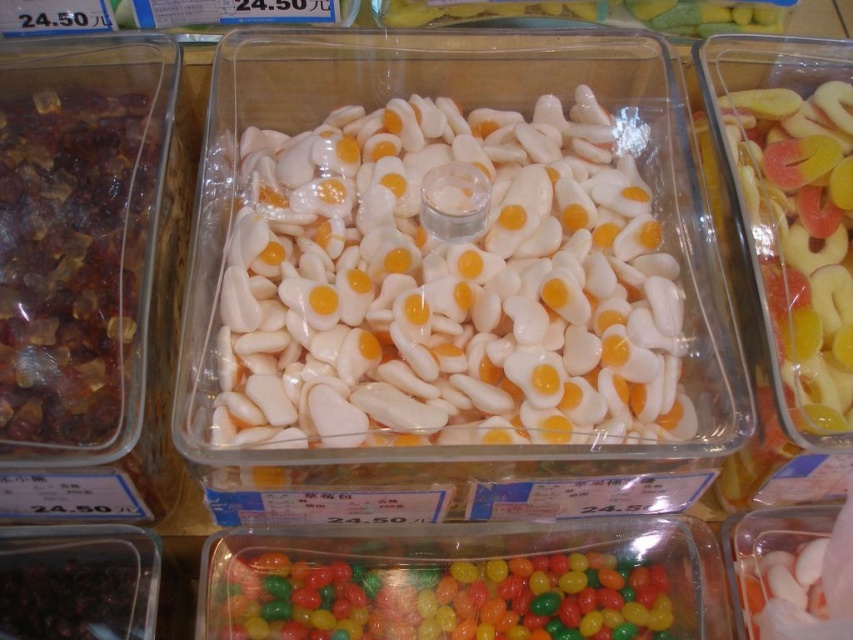
Looking at this image, between brown translucent gummy candies at left and glossy plastic jelly beans at lower center, which one has less height?

glossy plastic jelly beans at lower center is shorter.

The width and height of the screenshot is (853, 640). I want to click on brown translucent gummy candies at left, so click(71, 259).

Locate an element on the screen. brown translucent gummy candies at left is located at coordinates (71, 259).